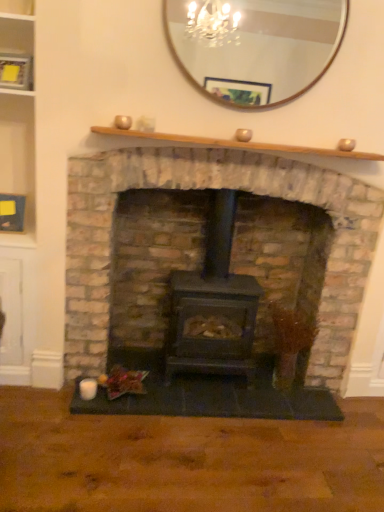
I want to click on matte black wood stove at center, so click(x=203, y=188).

The image size is (384, 512). What are the coordinates of `wooden mirror at upper center` in the screenshot? It's located at (254, 46).

The width and height of the screenshot is (384, 512). In order to click on wooden shelf at upper center in this screenshot , I will do `click(236, 144)`.

Does wooden shelf at upper center contain matte black wood stove at center?

That's incorrect, matte black wood stove at center is not inside wooden shelf at upper center.

Considering the sizes of wooden shelf at upper center and matte black wood stove at center in the image, is wooden shelf at upper center bigger or smaller than matte black wood stove at center?

Clearly, wooden shelf at upper center is smaller in size than matte black wood stove at center.

Does point (353, 155) appear closer or farther from the camera than point (72, 358)?

Point (353, 155) is closer to the camera than point (72, 358).

Between wooden shelf at upper center and matte black wood stove at center, which one has more height?

With more height is matte black wood stove at center.

Does black matte wood burning stove at center have a lesser width compared to wooden mirror at upper center?

No.

Does black matte wood burning stove at center have a lesser height compared to wooden mirror at upper center?

No, black matte wood burning stove at center is not shorter than wooden mirror at upper center.

Is black matte wood burning stove at center positioned behind wooden mirror at upper center?

Yes, black matte wood burning stove at center is further from the camera.

Which object is positioned more to the left, black matte wood burning stove at center or wooden mirror at upper center?

black matte wood burning stove at center.

Is wooden mirror at upper center next to matte black wood stove at center?

No, wooden mirror at upper center is not making contact with matte black wood stove at center.

Measure the distance between wooden mirror at upper center and matte black wood stove at center.

The distance of wooden mirror at upper center from matte black wood stove at center is 26.76 inches.

Looking at this image, would you say wooden mirror at upper center is to the left or to the right of matte black wood stove at center in the picture?

Clearly, wooden mirror at upper center is on the right of matte black wood stove at center in the image.

Is matte black wood stove at center a part of wooden mirror at upper center?

Actually, matte black wood stove at center is outside wooden mirror at upper center.

In terms of size, does black matte wood burning stove at center appear bigger or smaller than wooden shelf at upper center?

In the image, black matte wood burning stove at center appears to be larger than wooden shelf at upper center.

From the image's perspective, between black matte wood burning stove at center and wooden shelf at upper center, which one is located above?

From the image's view, wooden shelf at upper center is above.

Looking at this image, is black matte wood burning stove at center aimed at wooden shelf at upper center?

No, black matte wood burning stove at center is not aimed at wooden shelf at upper center.

Identify the location of wood burning stove beneath the wooden shelf at upper center (from a real-world perspective). The width and height of the screenshot is (384, 512). (212, 306).

Is wooden shelf at upper center oriented towards black matte wood burning stove at center?

No, wooden shelf at upper center is not oriented towards black matte wood burning stove at center.

Is point (360, 156) closer to viewer compared to point (200, 303)?

Yes, point (360, 156) is in front of point (200, 303).

From the image's perspective, does wooden shelf at upper center appear higher than black matte wood burning stove at center?

Indeed, from the image's perspective, wooden shelf at upper center is shown above black matte wood burning stove at center.

Between wooden shelf at upper center and black matte wood burning stove at center, which one is positioned in front?

wooden shelf at upper center is closer to the camera.

Looking at this image, from the image's perspective, is matte black wood stove at center under wooden mirror at upper center?

Indeed, from the image's perspective, matte black wood stove at center is shown beneath wooden mirror at upper center.

Which of these two, matte black wood stove at center or wooden mirror at upper center, is smaller?

wooden mirror at upper center is smaller.

Image resolution: width=384 pixels, height=512 pixels. In order to click on fireplace located underneath the wooden mirror at upper center (from a real-world perspective) in this screenshot , I will do `click(203, 188)`.

How much distance is there between matte black wood stove at center and wooden mirror at upper center?

matte black wood stove at center and wooden mirror at upper center are 26.76 inches apart.

Can you confirm if wooden mirror at upper center is smaller than wooden shelf at upper center?

Actually, wooden mirror at upper center might be larger than wooden shelf at upper center.

The height and width of the screenshot is (512, 384). Find the location of `mirror on the right of the wooden shelf at upper center`. mirror on the right of the wooden shelf at upper center is located at coordinates (254, 46).

Can wooden shelf at upper center be found inside wooden mirror at upper center?

No, wooden shelf at upper center is not surrounded by wooden mirror at upper center.

The image size is (384, 512). What are the coordinates of `mantle that is behind the matte black wood stove at center` in the screenshot? It's located at (236, 144).

The image size is (384, 512). I want to click on mirror on the right of black matte wood burning stove at center, so click(254, 46).

Based on their spatial positions, is black matte wood burning stove at center or wooden shelf at upper center further from matte black wood stove at center?

black matte wood burning stove at center lies further to matte black wood stove at center than the other object.

In the scene shown: Estimate the real-world distances between objects in this image. Which object is further from black matte wood burning stove at center, matte black wood stove at center or wooden shelf at upper center?

wooden shelf at upper center.

Based on their spatial positions, is black matte wood burning stove at center or wooden shelf at upper center further from wooden mirror at upper center?

black matte wood burning stove at center.

When comparing their distances from wooden shelf at upper center, does matte black wood stove at center or black matte wood burning stove at center seem further?

black matte wood burning stove at center lies further to wooden shelf at upper center than the other object.

Based on their spatial positions, is wooden mirror at upper center or matte black wood stove at center closer to black matte wood burning stove at center?

The object closer to black matte wood burning stove at center is matte black wood stove at center.

Based on the photo, when comparing their distances from black matte wood burning stove at center, does wooden mirror at upper center or wooden shelf at upper center seem closer?

Among the two, wooden shelf at upper center is located nearer to black matte wood burning stove at center.

When comparing their distances from wooden shelf at upper center, does matte black wood stove at center or wooden mirror at upper center seem closer?

The object closer to wooden shelf at upper center is matte black wood stove at center.

Estimate the real-world distances between objects in this image. Which object is closer to wooden shelf at upper center, wooden mirror at upper center or matte black wood stove at center?

Based on the image, matte black wood stove at center appears to be nearer to wooden shelf at upper center.

The width and height of the screenshot is (384, 512). What are the coordinates of `fireplace between wooden mirror at upper center and black matte wood burning stove at center in the up-down direction` in the screenshot? It's located at (203, 188).

Where is `fireplace that lies between wooden shelf at upper center and black matte wood burning stove at center from top to bottom`? fireplace that lies between wooden shelf at upper center and black matte wood burning stove at center from top to bottom is located at coordinates (203, 188).

Find the location of `mantle between wooden mirror at upper center and black matte wood burning stove at center in the up-down direction`. mantle between wooden mirror at upper center and black matte wood burning stove at center in the up-down direction is located at coordinates (236, 144).

Image resolution: width=384 pixels, height=512 pixels. I want to click on mantle between wooden mirror at upper center and matte black wood stove at center in the up-down direction, so click(236, 144).